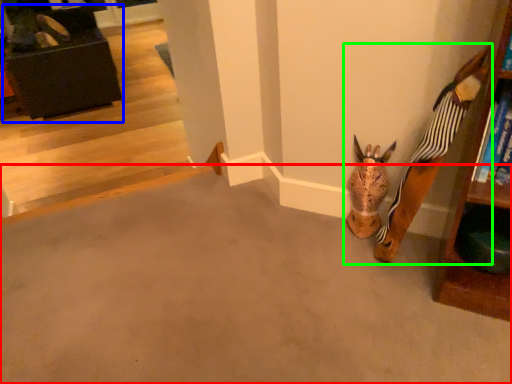
Question: Which object is positioned farthest from concrete (highlighted by a red box)? Select from furniture (highlighted by a blue box) and toy (highlighted by a green box).

Choices:
 (A) furniture
 (B) toy

Answer: (A)